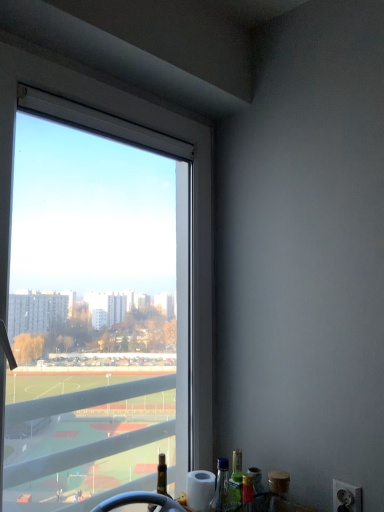
Question: Is white plastic power outlet at lower right not near green glass bottle at lower right?

Choices:
 (A) no
 (B) yes

Answer: (A)

Question: Is white plastic power outlet at lower right placed right next to green glass bottle at lower right?

Choices:
 (A) no
 (B) yes

Answer: (A)

Question: Is green glass bottle at lower right surrounded by white plastic power outlet at lower right?

Choices:
 (A) yes
 (B) no

Answer: (B)

Question: Is white plastic power outlet at lower right in front of green glass bottle at lower right?

Choices:
 (A) yes
 (B) no

Answer: (A)

Question: Is white plastic power outlet at lower right at the right side of green glass bottle at lower right?

Choices:
 (A) yes
 (B) no

Answer: (A)

Question: Does white plastic power outlet at lower right have a lesser height compared to green glass bottle at lower right?

Choices:
 (A) no
 (B) yes

Answer: (B)

Question: From a real-world perspective, is transparent glass window at upper left located beneath white plastic power outlet at lower right?

Choices:
 (A) no
 (B) yes

Answer: (A)

Question: Considering the relative sizes of transparent glass window at upper left and white plastic power outlet at lower right in the image provided, is transparent glass window at upper left smaller than white plastic power outlet at lower right?

Choices:
 (A) yes
 (B) no

Answer: (B)

Question: Is transparent glass window at upper left far from white plastic power outlet at lower right?

Choices:
 (A) no
 (B) yes

Answer: (A)

Question: Would you say transparent glass window at upper left contains white plastic power outlet at lower right?

Choices:
 (A) yes
 (B) no

Answer: (B)

Question: Is transparent glass window at upper left in contact with white plastic power outlet at lower right?

Choices:
 (A) no
 (B) yes

Answer: (A)

Question: Is transparent glass window at upper left taller than white plastic power outlet at lower right?

Choices:
 (A) no
 (B) yes

Answer: (B)

Question: Are white plastic power outlet at lower right and transparent glass window at upper left located far from each other?

Choices:
 (A) yes
 (B) no

Answer: (B)